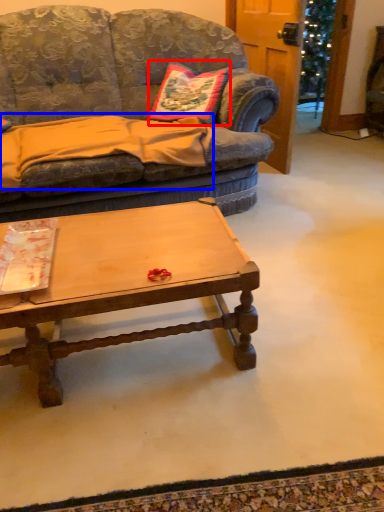
Question: Which object is closer to the camera taking this photo, pillow (highlighted by a red box) or blanket (highlighted by a blue box)?

Choices:
 (A) pillow
 (B) blanket

Answer: (B)